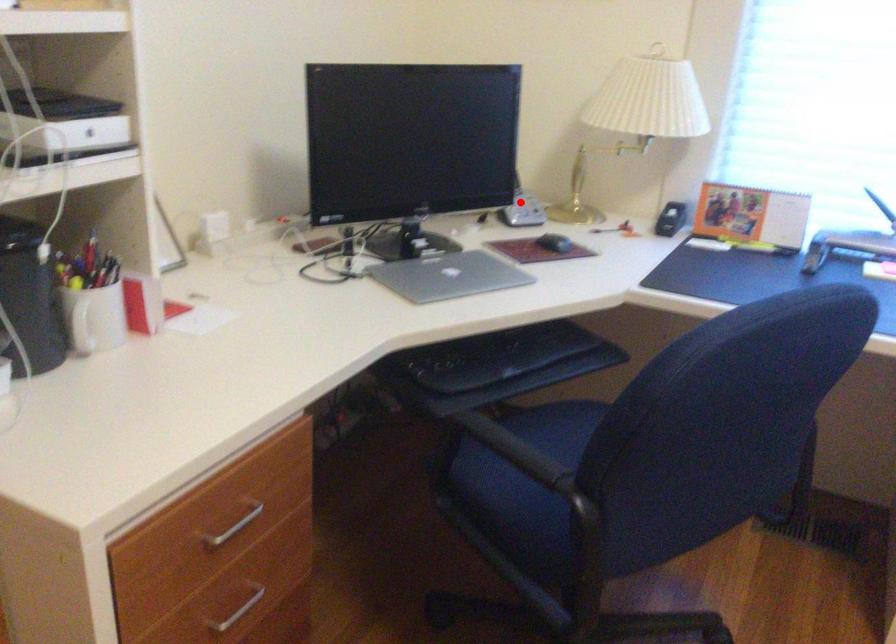
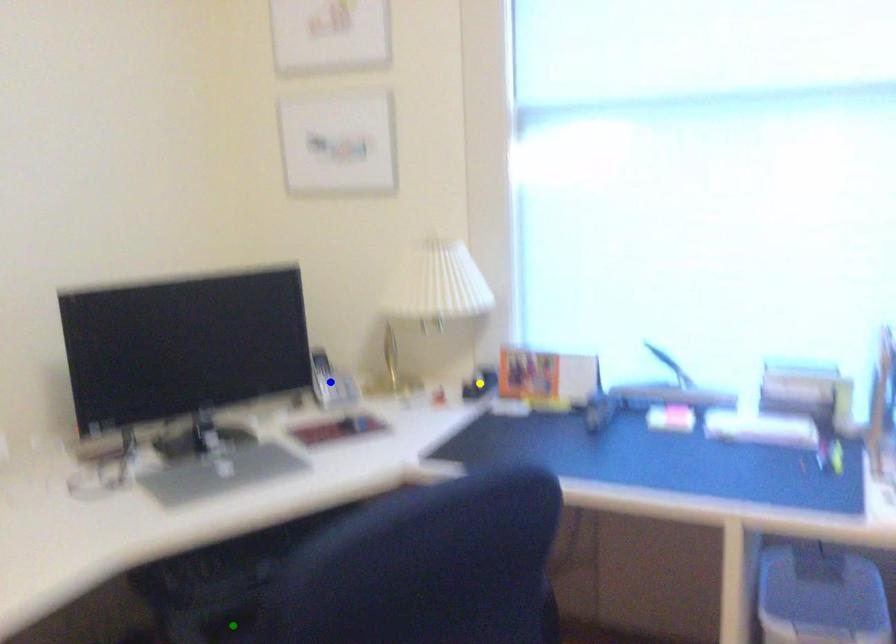
Question: I am providing you with two images of the same scene from different viewpoints. A red point is marked on the first image. You are given multiple points on the second image. Which mark in image 2 goes with the point in image 1?

Choices:
 (A) green point
 (B) blue point
 (C) yellow point

Answer: (B)